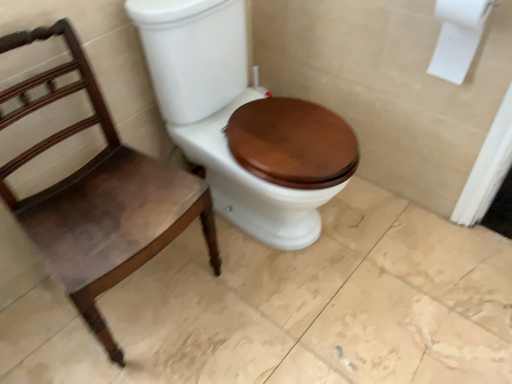
Question: Should I look upward or downward to see mahogany wood chair at left?

Choices:
 (A) down
 (B) up

Answer: (A)

Question: Considering the relative sizes of matte brown wood toilet seat at center and mahogany wood chair at left in the image provided, is matte brown wood toilet seat at center shorter than mahogany wood chair at left?

Choices:
 (A) no
 (B) yes

Answer: (A)

Question: From the image's perspective, is matte brown wood toilet seat at center on top of mahogany wood chair at left?

Choices:
 (A) yes
 (B) no

Answer: (A)

Question: Considering the relative sizes of matte brown wood toilet seat at center and mahogany wood chair at left in the image provided, is matte brown wood toilet seat at center taller than mahogany wood chair at left?

Choices:
 (A) yes
 (B) no

Answer: (A)

Question: Is matte brown wood toilet seat at center aimed at mahogany wood chair at left?

Choices:
 (A) yes
 (B) no

Answer: (B)

Question: Is matte brown wood toilet seat at center oriented away from mahogany wood chair at left?

Choices:
 (A) yes
 (B) no

Answer: (B)

Question: Are matte brown wood toilet seat at center and mahogany wood chair at left beside each other?

Choices:
 (A) yes
 (B) no

Answer: (B)

Question: Is mahogany wood chair at left positioned before matte brown wood toilet seat at center?

Choices:
 (A) yes
 (B) no

Answer: (A)

Question: Is mahogany wood chair at left taller than matte brown wood toilet seat at center?

Choices:
 (A) yes
 (B) no

Answer: (B)

Question: From the image's perspective, is mahogany wood chair at left above matte brown wood toilet seat at center?

Choices:
 (A) no
 (B) yes

Answer: (A)

Question: From a real-world perspective, is mahogany wood chair at left physically below matte brown wood toilet seat at center?

Choices:
 (A) yes
 (B) no

Answer: (A)

Question: Is mahogany wood chair at left thinner than matte brown wood toilet seat at center?

Choices:
 (A) yes
 (B) no

Answer: (A)

Question: Does mahogany wood chair at left have a lesser height compared to matte brown wood toilet seat at center?

Choices:
 (A) no
 (B) yes

Answer: (B)

Question: Does matte brown wood toilet seat at center have a larger size compared to white paper at upper right?

Choices:
 (A) yes
 (B) no

Answer: (A)